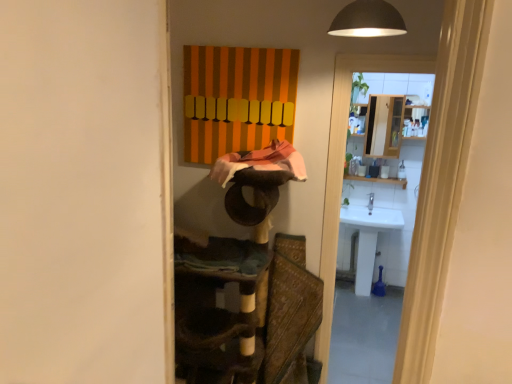
Question: In terms of height, does textured brown fabric swivel chair at center look taller or shorter compared to white glossy sink at right?

Choices:
 (A) tall
 (B) short

Answer: (B)

Question: Is textured brown fabric swivel chair at center in front of or behind white glossy sink at right in the image?

Choices:
 (A) behind
 (B) front

Answer: (B)

Question: Estimate the real-world distances between objects in this image. Which object is farther from the white glossy sink at right?

Choices:
 (A) textured brown fabric swivel chair at center
 (B) white glossy sink at right

Answer: (A)

Question: Considering the real-world distances, which object is farthest from the white glossy sink at right?

Choices:
 (A) textured brown fabric swivel chair at center
 (B) white glossy sink at right

Answer: (A)